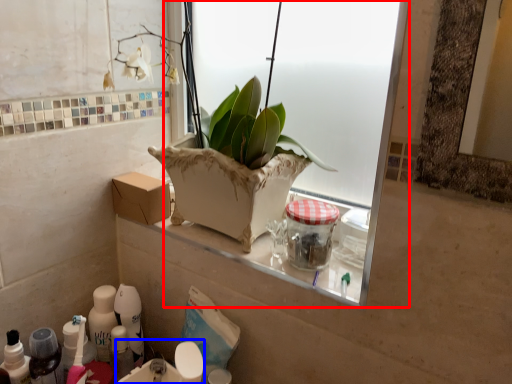
Question: Which point is further to the camera, window (highlighted by a red box) or sink (highlighted by a blue box)?

Choices:
 (A) window
 (B) sink

Answer: (B)